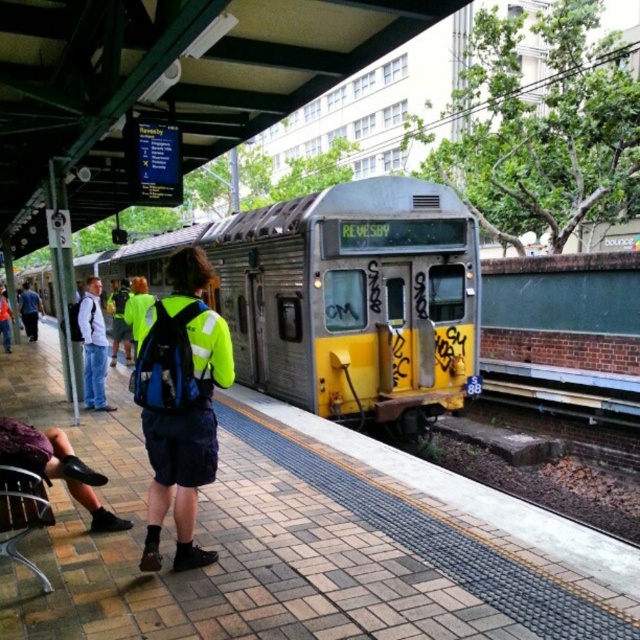
You are a passenger standing on the platform waiting for the train. You notice the yellow metallic train at center and the light blue jeans at left. Which object is wider?

The yellow metallic train at center is wider than the light blue jeans at left.

You are standing on the platform and see the yellow metallic train at center and the light blue jeans at left. Which object is higher in elevation?

The yellow metallic train at center is higher in elevation than the light blue jeans at left.

You are standing on the platform and see the yellow metallic train at center and the light blue jeans at left. Which object is closer to the edge of the platform?

The yellow metallic train at center is positioned on the left side of light blue jeans at left, so the train is closer to the edge of the platform than the light blue jeans at left.